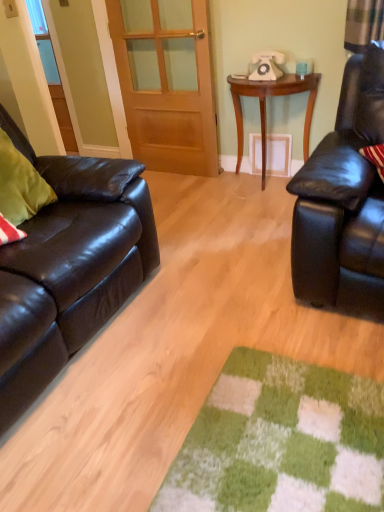
Question: From a real-world perspective, does wooden door at center stand above shiny black leather couch at left?

Choices:
 (A) yes
 (B) no

Answer: (A)

Question: Considering the relative positions of wooden door at center and shiny black leather couch at left in the image provided, is wooden door at center to the right of shiny black leather couch at left from the viewer's perspective?

Choices:
 (A) yes
 (B) no

Answer: (A)

Question: Is wooden door at center next to shiny black leather couch at left and touching it?

Choices:
 (A) no
 (B) yes

Answer: (A)

Question: Is shiny black leather couch at left located within wooden door at center?

Choices:
 (A) yes
 (B) no

Answer: (B)

Question: Considering the relative sizes of wooden door at center and shiny black leather couch at left in the image provided, is wooden door at center smaller than shiny black leather couch at left?

Choices:
 (A) no
 (B) yes

Answer: (B)

Question: From the image's perspective, would you say wooden door at center is positioned over shiny black leather couch at left?

Choices:
 (A) no
 (B) yes

Answer: (B)

Question: Does white plastic telephone at upper center appear on the right side of wooden door at center?

Choices:
 (A) no
 (B) yes

Answer: (B)

Question: Is white plastic telephone at upper center not near wooden door at center?

Choices:
 (A) no
 (B) yes

Answer: (A)

Question: From the image's perspective, is white plastic telephone at upper center located above wooden door at center?

Choices:
 (A) no
 (B) yes

Answer: (B)

Question: Does white plastic telephone at upper center turn towards wooden door at center?

Choices:
 (A) no
 (B) yes

Answer: (A)

Question: From the image's perspective, does white plastic telephone at upper center appear lower than wooden door at center?

Choices:
 (A) yes
 (B) no

Answer: (B)

Question: Is white plastic telephone at upper center wider than wooden door at center?

Choices:
 (A) no
 (B) yes

Answer: (B)

Question: Is wooden table at center wider than matte black leather couch at left?

Choices:
 (A) no
 (B) yes

Answer: (A)